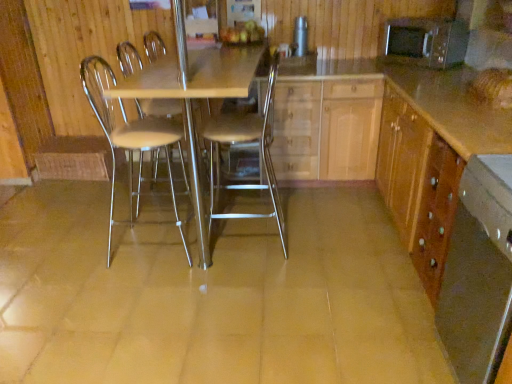
Question: From a real-world perspective, is metallic cylindrical container at upper center, the 1th appliance in the left-to-right sequence, beneath light wood/texture cabinet at center, acting as the 2th cabinetry starting from the right?

Choices:
 (A) no
 (B) yes

Answer: (A)

Question: Is metallic cylindrical container at upper center, the second appliance in the right-to-left sequence, far from light wood/texture cabinet at center, acting as the 2th cabinetry starting from the right?

Choices:
 (A) yes
 (B) no

Answer: (B)

Question: Does metallic cylindrical container at upper center, the 1th appliance in the left-to-right sequence, lie behind light wood/texture cabinet at center, acting as the 2th cabinetry starting from the right?

Choices:
 (A) yes
 (B) no

Answer: (A)

Question: Considering the relative positions of metallic cylindrical container at upper center, the second appliance in the right-to-left sequence, and light wood/texture cabinet at center, placed as the first cabinetry when sorted from left to right, in the image provided, is metallic cylindrical container at upper center, the second appliance in the right-to-left sequence, to the right of light wood/texture cabinet at center, placed as the first cabinetry when sorted from left to right, from the viewer's perspective?

Choices:
 (A) yes
 (B) no

Answer: (B)

Question: From the image's perspective, is metallic cylindrical container at upper center, the 1th appliance in the left-to-right sequence, over light wood/texture cabinet at center, acting as the 2th cabinetry starting from the right?

Choices:
 (A) no
 (B) yes

Answer: (B)

Question: Could you tell me if metallic cylindrical container at upper center, the second appliance in the right-to-left sequence, is turned towards light wood/texture cabinet at center, placed as the first cabinetry when sorted from left to right?

Choices:
 (A) yes
 (B) no

Answer: (B)

Question: Is wooden cabinet at right, the second cabinetry viewed from the left, facing away from metallic silver chair at center, the 2th chair when ordered from right to left?

Choices:
 (A) no
 (B) yes

Answer: (A)

Question: Would you say metallic silver chair at center, the 2th chair when ordered from right to left, is part of wooden cabinet at right, which is the 1th cabinetry from right to left,'s contents?

Choices:
 (A) no
 (B) yes

Answer: (A)

Question: Considering the relative sizes of wooden cabinet at right, which is the 1th cabinetry from right to left, and metallic silver chair at center, which appears as the 1th chair when viewed from the left, in the image provided, is wooden cabinet at right, which is the 1th cabinetry from right to left, shorter than metallic silver chair at center, which appears as the 1th chair when viewed from the left,?

Choices:
 (A) yes
 (B) no

Answer: (A)

Question: Considering the relative positions of wooden cabinet at right, the second cabinetry viewed from the left, and metallic silver chair at center, the 2th chair when ordered from right to left, in the image provided, is wooden cabinet at right, the second cabinetry viewed from the left, in front of metallic silver chair at center, the 2th chair when ordered from right to left,?

Choices:
 (A) no
 (B) yes

Answer: (B)

Question: From a real-world perspective, is wooden cabinet at right, the second cabinetry viewed from the left, located beneath metallic silver chair at center, which appears as the 1th chair when viewed from the left?

Choices:
 (A) yes
 (B) no

Answer: (A)

Question: Can you confirm if wooden cabinet at right, which is the 1th cabinetry from right to left, is positioned to the right of metallic silver chair at center, the 2th chair when ordered from right to left?

Choices:
 (A) yes
 (B) no

Answer: (A)

Question: Does metallic microwave at upper right, the 1th appliance positioned from the right, have a smaller size compared to wooden cabinet at right, the second cabinetry viewed from the left?

Choices:
 (A) no
 (B) yes

Answer: (B)